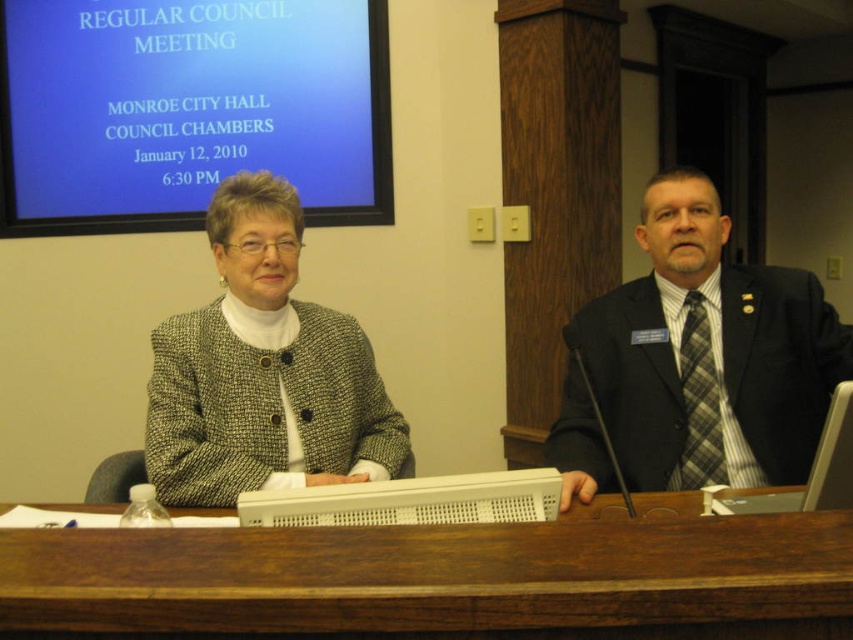
You are attending a council meeting at Monroe City Hall and notice two items of interest. The dark blue suit at right and the white plastic laptop at center. Which item is positioned to the right of the other?

The dark blue suit at right is positioned to the right of the white plastic laptop at center.

You are attending a council meeting at Monroe City Hall and need to present a slide. The blue glossy projector screen at upper center and the plastic keyboard at center are in front of you. Where should you look to present your slide?

You should look at the blue glossy projector screen at upper center because it is above the plastic keyboard at center and is likely where the presentation is displayed.

You are a photographer at the meeting and want to take a photo of the dark blue suit at right and the white plastic laptop at center. The minimum distance your camera can focus clearly is 28 inches. Will both subjects be in focus if they are positioned exactly as shown?

The dark blue suit at right is 28.57 inches from the white plastic laptop at center. Since the distance between them is just over 28 inches, the camera should be able to focus on both subjects clearly.